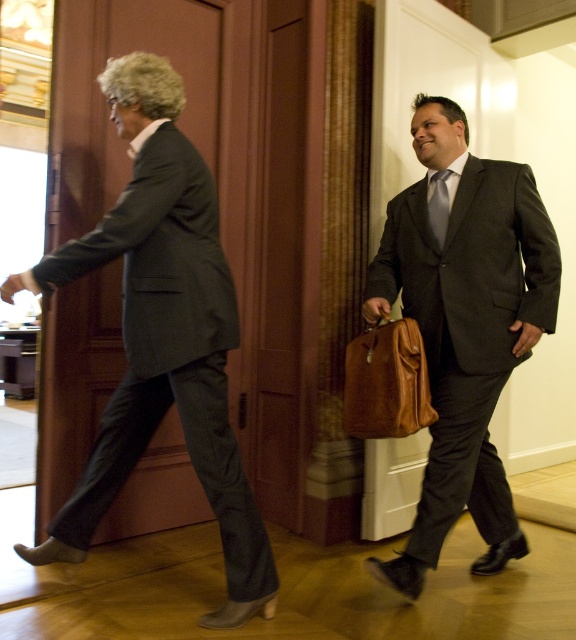
Who is lower down, matte black suit at left or silky blue tie at center?

matte black suit at left is lower down.

This screenshot has height=640, width=576. I want to click on matte black suit at left, so click(161, 336).

Image resolution: width=576 pixels, height=640 pixels. I want to click on matte black suit at left, so tap(161, 336).

Is matte black suit at right positioned behind silky blue tie at center?

No, matte black suit at right is closer to the viewer.

Image resolution: width=576 pixels, height=640 pixels. In order to click on matte black suit at right in this screenshot , I will do `click(464, 326)`.

Identify the location of matte black suit at right. (464, 326).

Can you confirm if brown leather briefcase at center is thinner than silky blue tie at center?

Incorrect, brown leather briefcase at center's width is not less than silky blue tie at center's.

Identify the location of brown leather briefcase at center. This screenshot has width=576, height=640. (386, 381).